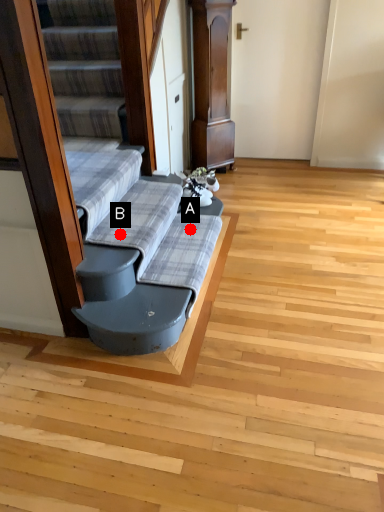
Question: Two points are circled on the image, labeled by A and B beside each circle. Which of the following is the closest to the observer?

Choices:
 (A) A is closer
 (B) B is closer

Answer: (B)